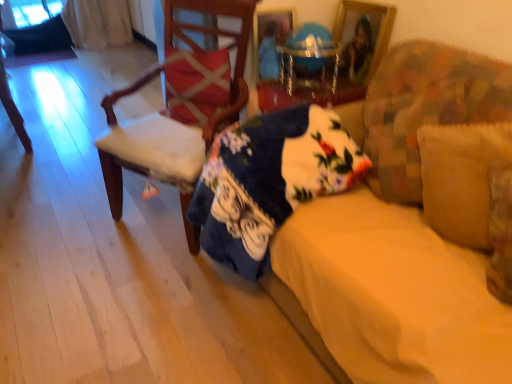
Question: From a real-world perspective, is wooden picture frame at upper center physically located above or below metallic blue globe at center?

Choices:
 (A) above
 (B) below

Answer: (B)

Question: Is wooden picture frame at upper center wider or thinner than metallic blue globe at center?

Choices:
 (A) wide
 (B) thin

Answer: (B)

Question: Estimate the real-world distances between objects in this image. Which object is farther from the fluffy fabric couch at center?

Choices:
 (A) suede-like beige pillow at right, the 2th pillow from the top
 (B) red textured pillow at center, which is counted as the 2th pillow, starting from the right
 (C) floral cotton blanket at center
 (D) wooden chair at left, which appears as the second chair when viewed from the left
 (E) matte white chair at left, which is counted as the second chair, starting from the right

Answer: (E)

Question: Estimate the real-world distances between objects in this image. Which object is closer to the floral cotton blanket at center?

Choices:
 (A) wooden picture frame at upper center
 (B) matte white chair at left, the first chair when ordered from back to front
 (C) red textured pillow at center, the 1th pillow in the back-to-front sequence
 (D) suede-like beige pillow at right, the 2th pillow from the top
 (E) wooden chair at left, placed as the first chair when sorted from right to left

Answer: (E)